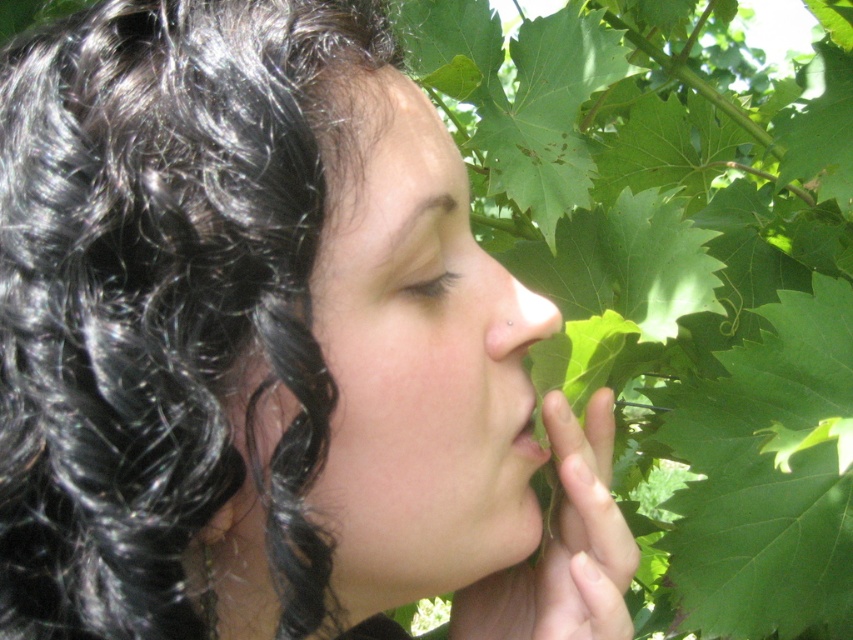
Does green leafy ivy at center appear under green leafy hand at center?

Incorrect, green leafy ivy at center is not positioned below green leafy hand at center.

I want to click on green leafy ivy at center, so click(679, 278).

Which is below, green leafy hand at center or matte skin nose at center?

green leafy hand at center is lower down.

Who is positioned more to the left, green leafy hand at center or matte skin nose at center?

From the viewer's perspective, matte skin nose at center appears more on the left side.

The width and height of the screenshot is (853, 640). What do you see at coordinates (563, 547) in the screenshot?
I see `green leafy hand at center` at bounding box center [563, 547].

Locate an element on the screen. The image size is (853, 640). green leafy hand at center is located at coordinates (563, 547).

From the picture: Who is positioned more to the right, smooth skin face at center or matte skin nose at center?

matte skin nose at center

Where is `smooth skin face at center`? smooth skin face at center is located at coordinates (413, 364).